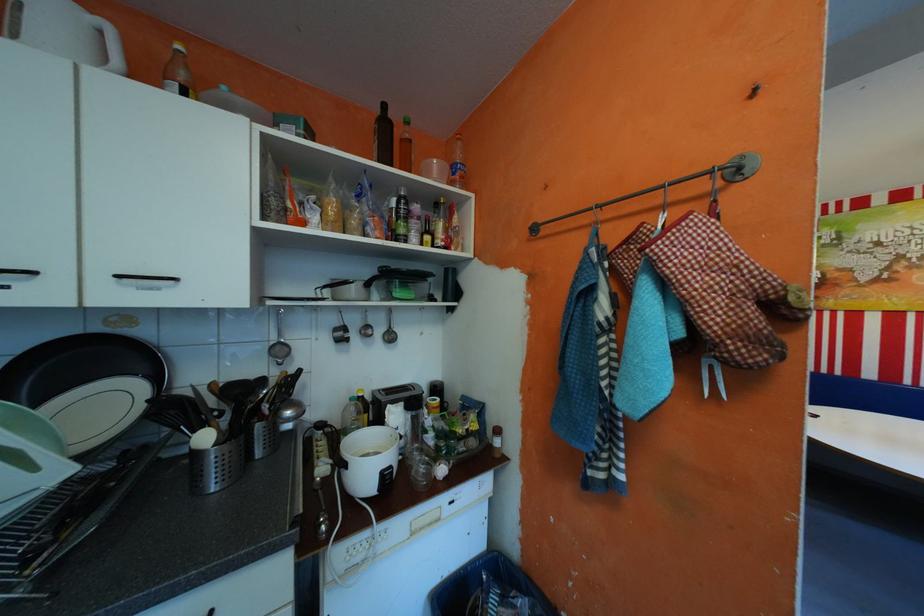
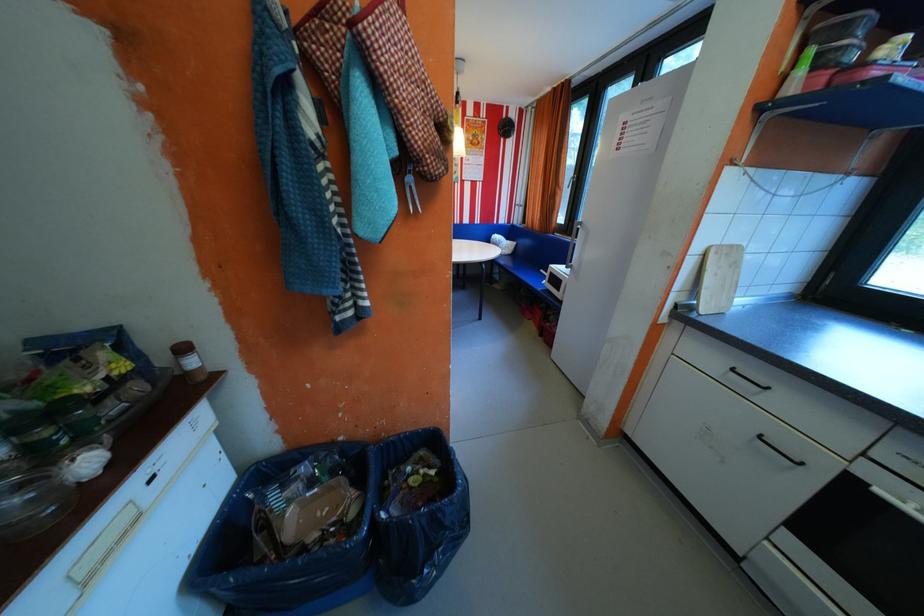
The images are taken continuously from a first-person perspective. In which direction is your viewpoint rotating?

The rotation direction of the camera is right-down.